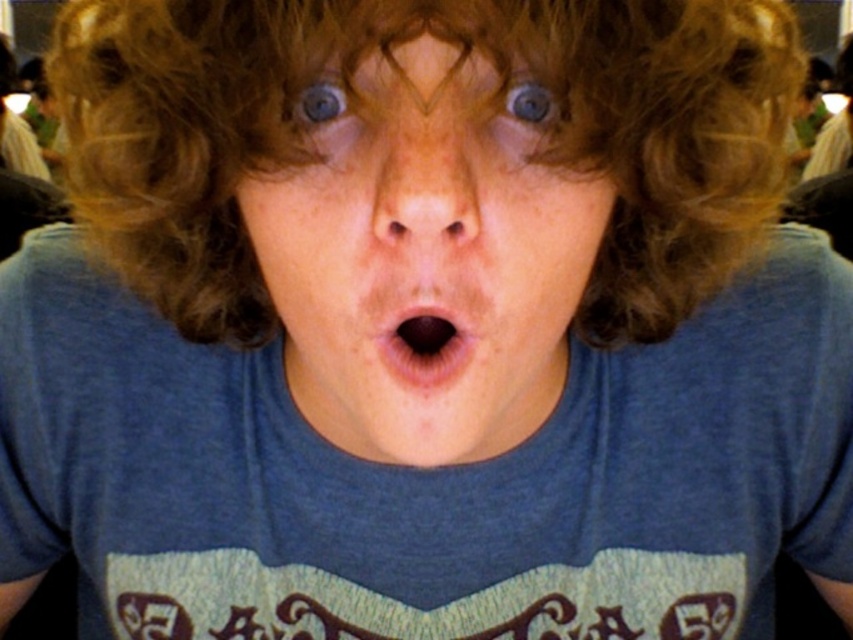
You are a photographer adjusting the lighting for a portrait. You notice the curly brown hair at center and the blue matte face at center in the frame. Considering the distance between them, can you estimate if the current lighting setup will evenly illuminate both areas without creating harsh shadows?

The curly brown hair at center is 1.70 inches from blue matte face at center, so the lighting setup may struggle to evenly illuminate both areas due to their close proximity. This could result in uneven lighting or harsh shadows between the two.

You are a makeup artist preparing to apply foundation on a client. You notice the dry skin nose at center and the blue glossy eye at upper center. Which feature should you address first to ensure proper application? Please explain your reasoning based on their positions.

The dry skin nose at center should be addressed first because it is positioned on the right side of the blue glossy eye at upper center, making it closer to the center of the face where foundation application needs to start to achieve a natural blend.

You are a photographer adjusting the framing of a portrait. The subject has curly brown hair at center and a blue matte face at center. Which part should you adjust the focus to ensure the wider object is in sharp focus?

The curly brown hair at center is wider than the blue matte face at center, so you should adjust the focus to the curly brown hair at center to ensure the wider object is in sharp focus.